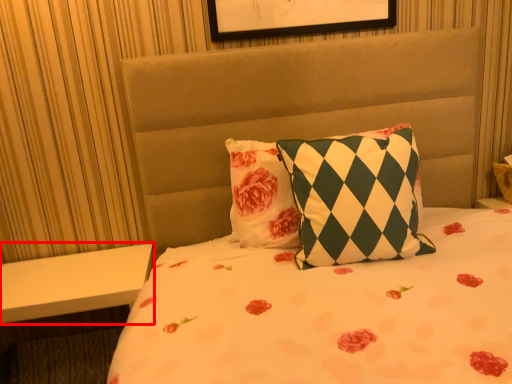
Question: In this image, where is table (annotated by the red box) located relative to pillow?

Choices:
 (A) right
 (B) left

Answer: (B)